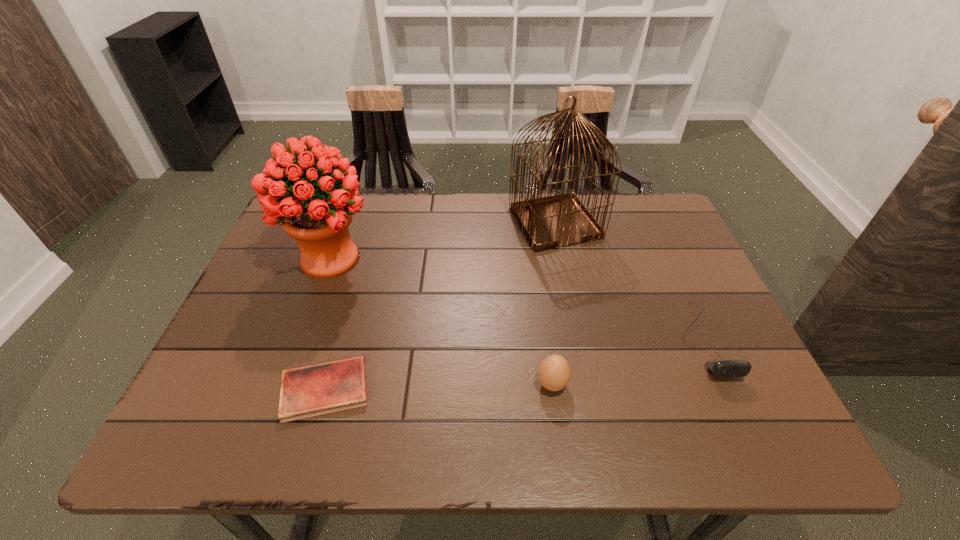
At what (x,y) coordinates should I click in order to perform the action: click on free spot located on the left of the shortest object. Please return your answer as a coordinate pair (x, y). Looking at the image, I should click on (215, 389).

The image size is (960, 540). I want to click on birdcage at the far edge, so click(x=547, y=222).

Locate an element on the screen. bouquet situated at the far edge is located at coordinates (293, 191).

You are a GUI agent. You are given a task and a screenshot of the screen. Output one action in this format:
    pyautogui.click(x=<x>, y=<y>)
    Task: Click on the object present at the near edge
    The width and height of the screenshot is (960, 540).
    Given the screenshot: What is the action you would take?
    pyautogui.click(x=319, y=389)

Locate an element on the screen. bouquet that is at the left edge is located at coordinates pos(293,191).

The image size is (960, 540). In order to click on diary that is at the left edge in this screenshot , I will do `click(319, 389)`.

The image size is (960, 540). Identify the location of object that is at the right edge. (725, 368).

Where is `object present at the far left corner`? This screenshot has height=540, width=960. object present at the far left corner is located at coordinates (293, 191).

Image resolution: width=960 pixels, height=540 pixels. I want to click on object located in the near left corner section of the desktop, so click(319, 389).

Find the location of a particular element. This screenshot has height=540, width=960. vacant space at the far edge is located at coordinates (591, 197).